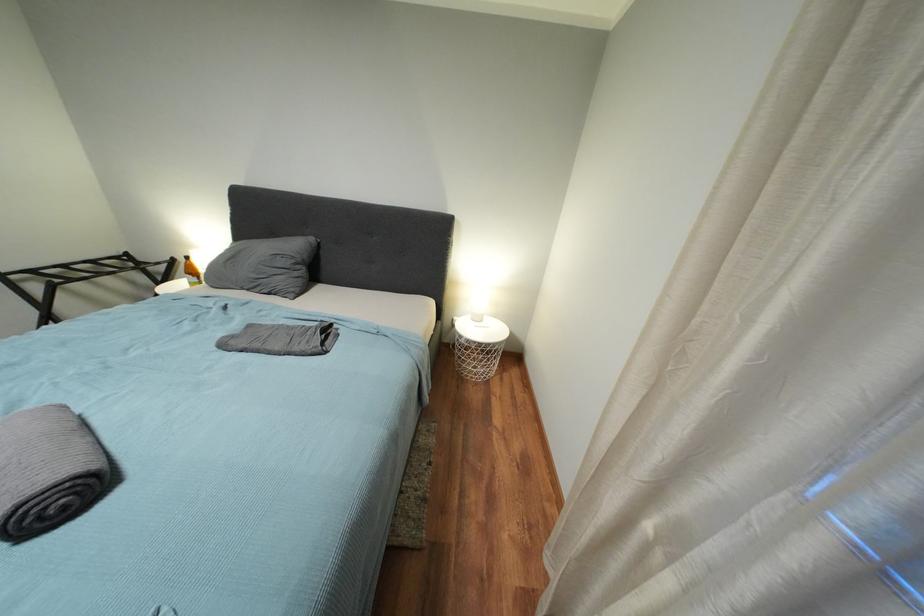
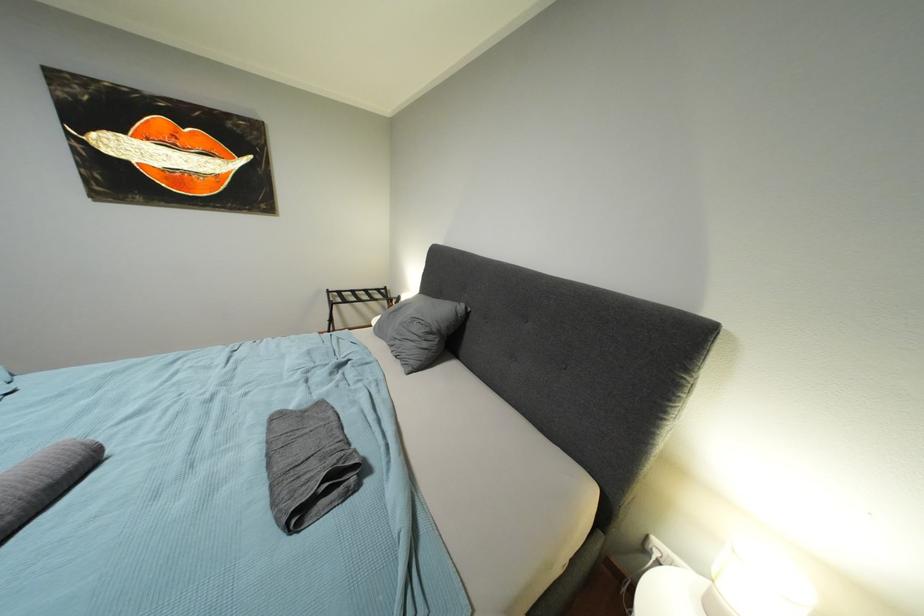
Question: The images are taken continuously from a first-person perspective. In which direction is your viewpoint rotating?

Choices:
 (A) Left
 (B) Right
 (C) Up
 (D) Down

Answer: (A)